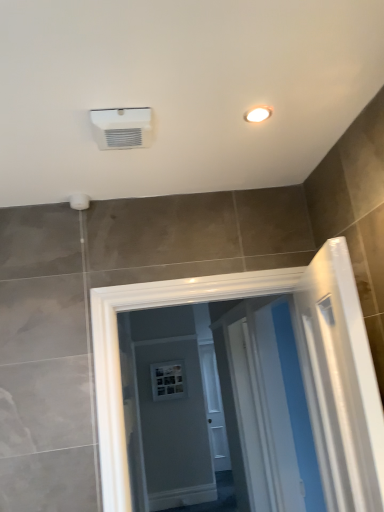
Question: Considering the positions of white glossy screen door at center and white plastic air conditioning unit at upper center in the image, is white glossy screen door at center wider or thinner than white plastic air conditioning unit at upper center?

Choices:
 (A) thin
 (B) wide

Answer: (B)

Question: Relative to white plastic air conditioning unit at upper center, is white glossy screen door at center in front or behind?

Choices:
 (A) front
 (B) behind

Answer: (B)

Question: Estimate the real-world distances between objects in this image. Which object is farther from the white glossy screen door at center?

Choices:
 (A) white plastic air conditioning unit at upper center
 (B) white glossy light fixture at upper right

Answer: (B)

Question: Estimate the real-world distances between objects in this image. Which object is closer to the white glossy light fixture at upper right?

Choices:
 (A) white glossy screen door at center
 (B) white plastic air conditioning unit at upper center

Answer: (B)